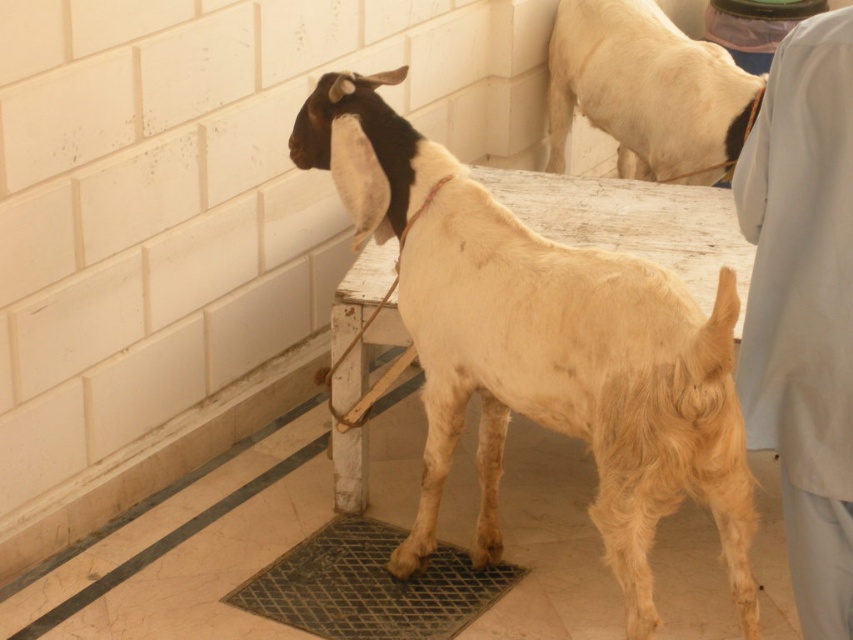
Question: Does light brown woolen goat at center have a greater width compared to light blue fabric at upper right?

Choices:
 (A) no
 (B) yes

Answer: (B)

Question: Which object appears farthest from the camera in this image?

Choices:
 (A) light beige fur at upper right
 (B) metallic grid at lower center
 (C) light brown woolen goat at center

Answer: (A)

Question: Among these objects, which one is nearest to the camera?

Choices:
 (A) light brown woolen goat at center
 (B) light beige fur at upper right
 (C) metallic grid at lower center

Answer: (A)

Question: Does light brown woolen goat at center have a greater width compared to metallic grid at lower center?

Choices:
 (A) yes
 (B) no

Answer: (A)

Question: Which object is positioned closest to the light brown woolen goat at center?

Choices:
 (A) light beige fur at upper right
 (B) metallic grid at lower center

Answer: (B)

Question: Is light brown woolen goat at center thinner than light beige fur at upper right?

Choices:
 (A) no
 (B) yes

Answer: (A)